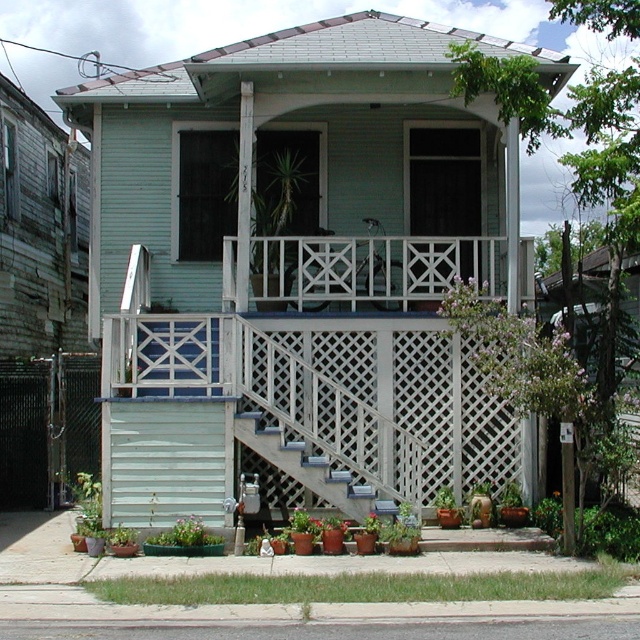
Question: Which point is farther to the camera?

Choices:
 (A) (193, 531)
 (B) (502, 488)
 (C) (380, 512)
 (D) (598, 552)

Answer: (B)

Question: Can you confirm if green leafy grass at lower center is positioned to the right of green leafy plant at center?

Choices:
 (A) no
 (B) yes

Answer: (A)

Question: Can you confirm if wooden stairs at center is smaller than green leafy plant at center?

Choices:
 (A) yes
 (B) no

Answer: (B)

Question: Which object is farther from the camera taking this photo?

Choices:
 (A) green matte pot at lower center
 (B) green leafy plant at center
 (C) green leafy bush at lower right
 (D) green leafy grass at lower center

Answer: (B)

Question: Which object is the farthest from the green leafy plant at center?

Choices:
 (A) green leafy bush at lower right
 (B) green leafy plant at lower center

Answer: (B)

Question: Is green leafy plant at center bigger than green matte pot at lower center?

Choices:
 (A) yes
 (B) no

Answer: (A)